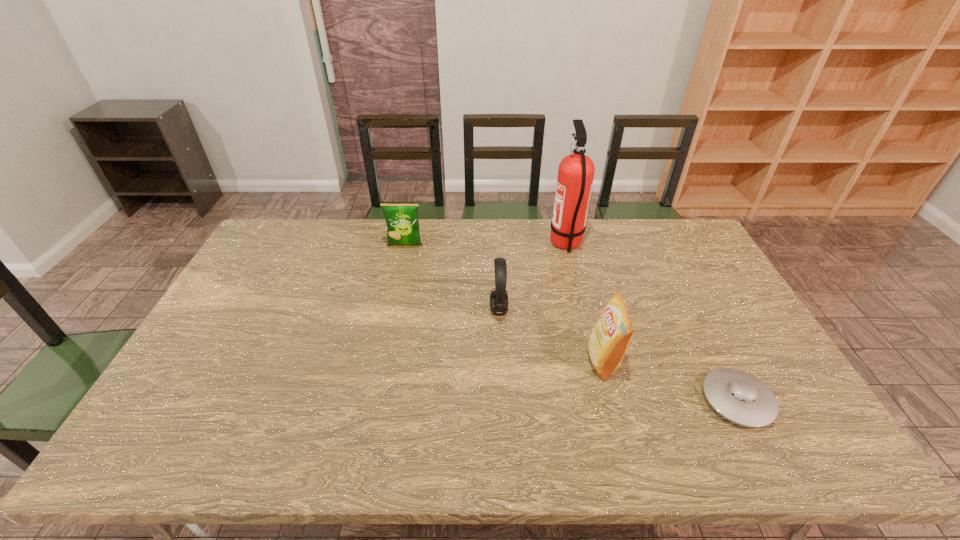
Locate an element on the screen. This screenshot has height=540, width=960. crisp (potato chip) that is at the far edge is located at coordinates (402, 221).

Identify the location of object located in the near edge section of the desktop. (738, 396).

Where is `object present at the right edge`? The image size is (960, 540). object present at the right edge is located at coordinates (738, 396).

Where is `object at the near right corner`? The height and width of the screenshot is (540, 960). object at the near right corner is located at coordinates (738, 396).

Locate an element on the screen. Image resolution: width=960 pixels, height=540 pixels. blank space at the far edge of the desktop is located at coordinates (520, 256).

I want to click on blank space at the left edge of the desktop, so click(262, 275).

Locate an element on the screen. The height and width of the screenshot is (540, 960). vacant space at the right edge of the desktop is located at coordinates (693, 312).

In the image, there is a desktop. Where is `free space at the near left corner`? free space at the near left corner is located at coordinates (178, 444).

This screenshot has width=960, height=540. In the image, there is a desktop. Identify the location of vacant region at the far right corner. (692, 231).

Identify the location of empty space between the leftmost object and the tallest object. (486, 245).